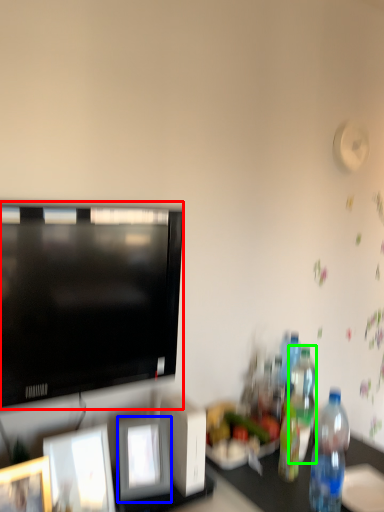
Question: Which is nearer to the television (highlighted by a red box)? picture frame (highlighted by a blue box) or bottle (highlighted by a green box).

Choices:
 (A) picture frame
 (B) bottle

Answer: (A)